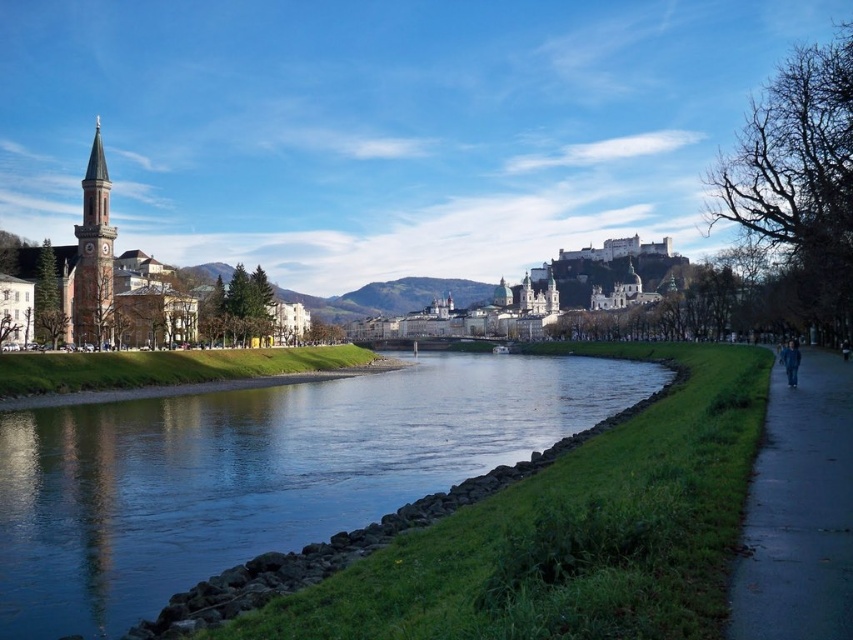
Question: Does blue water at center appear on the right side of dark asphalt sidewalk at right?

Choices:
 (A) no
 (B) yes

Answer: (A)

Question: Based on their relative distances, which object is nearer to the matte red brick clock tower at left?

Choices:
 (A) blue fabric jacket at lower right
 (B) blue water at center
 (C) dark asphalt sidewalk at right

Answer: (B)

Question: Which point appears farthest from the camera in this image?

Choices:
 (A) (534, 371)
 (B) (850, 524)

Answer: (A)

Question: Can you confirm if dark asphalt sidewalk at right is positioned below matte red brick clock tower at left?

Choices:
 (A) no
 (B) yes

Answer: (B)

Question: Can you confirm if dark asphalt sidewalk at right is thinner than matte red brick clock tower at left?

Choices:
 (A) yes
 (B) no

Answer: (B)

Question: Which object is the closest to the matte red brick clock tower at left?

Choices:
 (A) dark asphalt sidewalk at right
 (B) blue fabric jacket at lower right
 (C) blue water at center

Answer: (C)